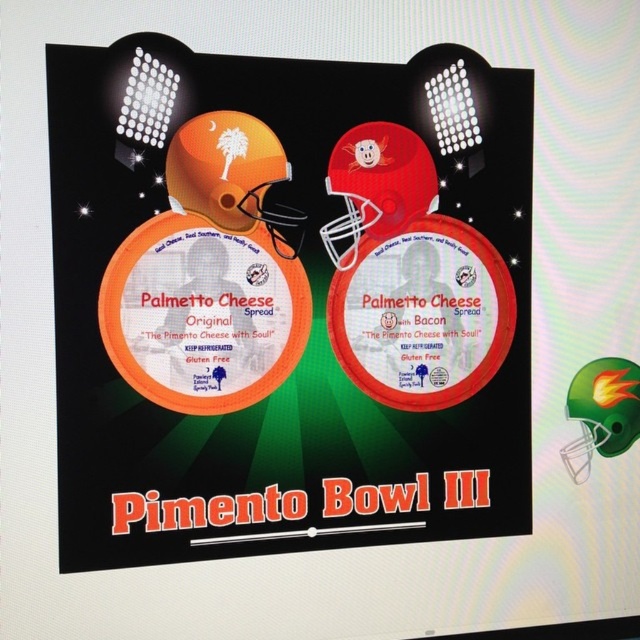
Question: Does orange matte helmet at upper center have a smaller size compared to orange matte helmet at upper left?

Choices:
 (A) yes
 (B) no

Answer: (B)

Question: In this image, where is matte red helmet at center located relative to orange matte helmet at upper left?

Choices:
 (A) right
 (B) left

Answer: (A)

Question: Which point is closer to the camera?

Choices:
 (A) (362, 161)
 (B) (112, 253)

Answer: (B)

Question: Is orange matte helmet at upper center positioned at the back of matte red helmet at center?

Choices:
 (A) yes
 (B) no

Answer: (B)

Question: Based on their relative distances, which object is farther from the orange matte helmet at upper left?

Choices:
 (A) matte red helmet at center
 (B) orange matte helmet at upper center

Answer: (A)

Question: Which object is positioned closest to the orange matte helmet at upper center?

Choices:
 (A) matte red helmet at center
 (B) orange matte helmet at upper left

Answer: (A)